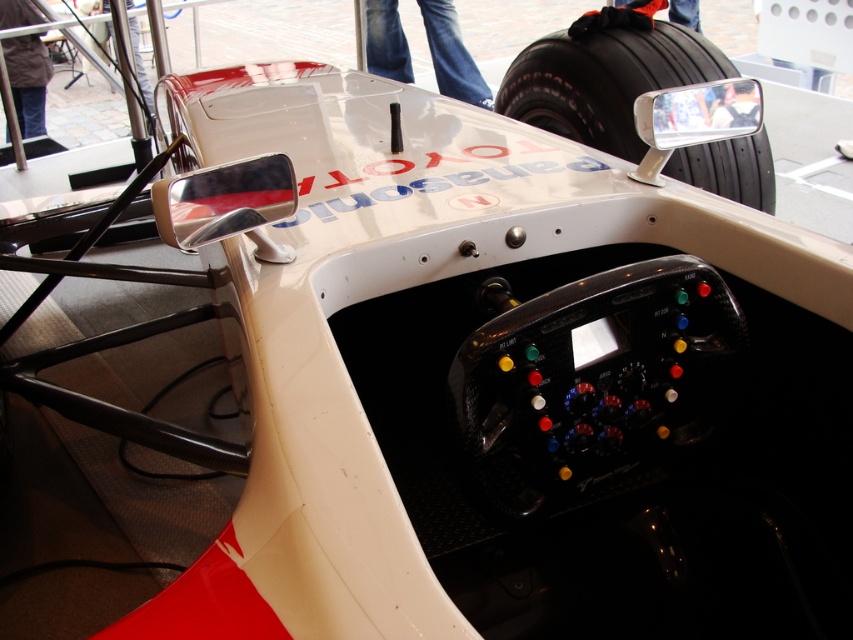
Which is more to the left, black rubber tire at upper right or jeans at upper center?

jeans at upper center is more to the left.

Which is below, black rubber tire at upper right or jeans at upper center?

Positioned lower is black rubber tire at upper right.

Is point (692, 44) farther from camera compared to point (405, 68)?

No.

Where is `black rubber tire at upper right`? black rubber tire at upper right is located at coordinates (604, 81).